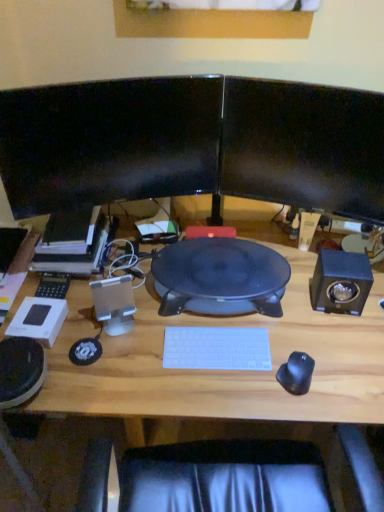
At what (x,y) coordinates should I click in order to perform the action: click on free space to the left of white plastic keyboard at center. Please return your answer as a coordinate pair (x, y). Looking at the image, I should click on (142, 353).